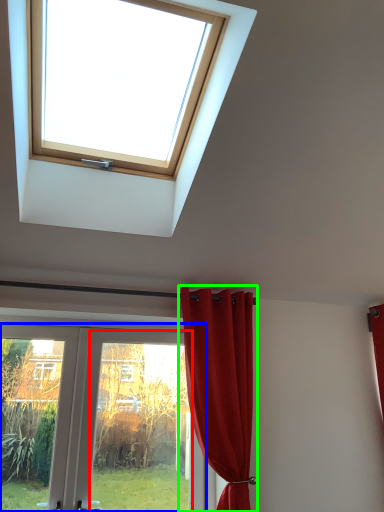
Question: Based on their relative distances, which object is nearer to glass door (highlighted by a red box)? Choose from door (highlighted by a blue box) and curtain (highlighted by a green box).

Choices:
 (A) door
 (B) curtain

Answer: (A)